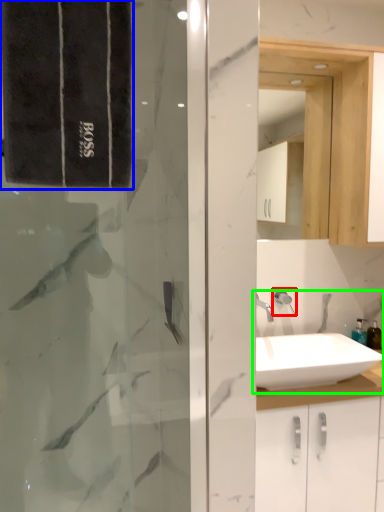
Question: Estimate the real-world distances between objects in this image. Which object is farther from shower (highlighted by a red box), bath towel (highlighted by a blue box) or sink (highlighted by a green box)?

Choices:
 (A) bath towel
 (B) sink

Answer: (A)